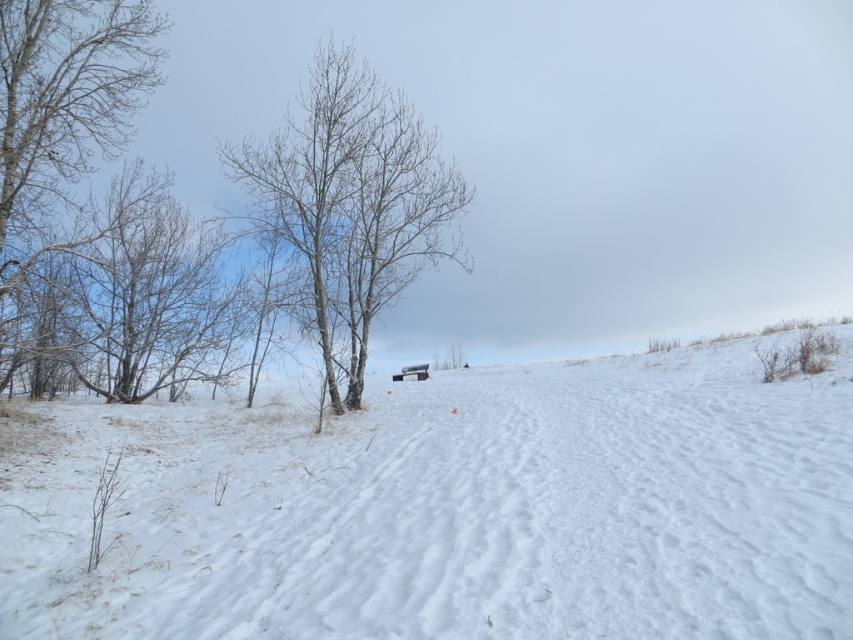
Question: Which of the following is the farthest from the observer?

Choices:
 (A) (111, 390)
 (B) (3, 563)
 (C) (22, 81)
 (D) (350, 204)

Answer: (A)

Question: Does white snow ski slope at center appear on the right side of bare wood tree at center?

Choices:
 (A) yes
 (B) no

Answer: (A)

Question: Which object is the farthest from the bare wood tree at center?

Choices:
 (A) smooth white tree at left
 (B) white snow ski slope at center
 (C) bare branches at left

Answer: (A)

Question: Can you confirm if smooth white tree at left is wider than bare branches at left?

Choices:
 (A) yes
 (B) no

Answer: (A)

Question: Considering the relative positions of bare wood tree at center and smooth white tree at left in the image provided, where is bare wood tree at center located with respect to smooth white tree at left?

Choices:
 (A) left
 (B) right

Answer: (B)

Question: Among these points, which one is farthest from the camera?

Choices:
 (A) (25, 292)
 (B) (428, 225)
 (C) (250, 499)

Answer: (B)